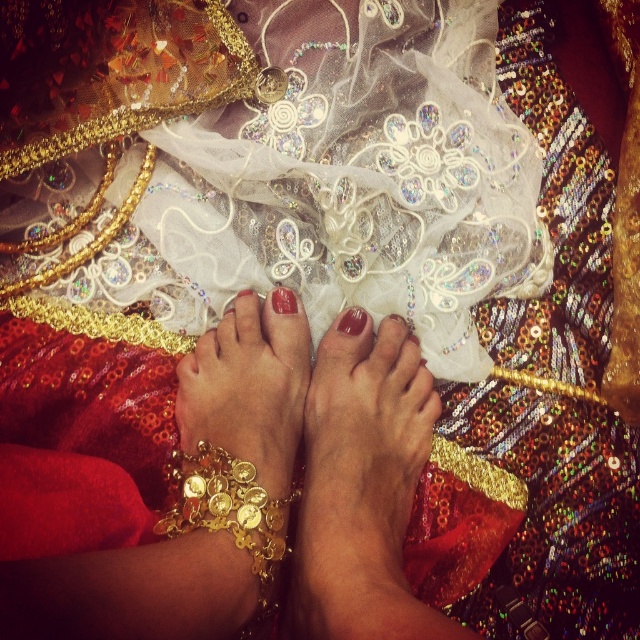
Does gold metallic anklet at center have a larger size compared to matte gold toe at center?

Yes, gold metallic anklet at center is bigger than matte gold toe at center.

Between gold metallic anklet at center and matte gold toe at center, which one is positioned higher?

Positioned higher is matte gold toe at center.

Which is behind, point (240, 506) or point (284, 289)?

Point (284, 289)

Where is `gold metallic anklet at center`? This screenshot has width=640, height=640. gold metallic anklet at center is located at coordinates (234, 467).

What do you see at coordinates (362, 486) in the screenshot?
I see `satin skin at center` at bounding box center [362, 486].

Identify the location of satin skin at center. The image size is (640, 640). (362, 486).

Is gold metallic anklet at center smaller than glossy nail polish at center?

No, gold metallic anklet at center is not smaller than glossy nail polish at center.

How far apart are gold metallic anklet at center and glossy nail polish at center?

The distance of gold metallic anklet at center from glossy nail polish at center is 6.12 inches.

Locate an element on the screen. Image resolution: width=640 pixels, height=640 pixels. gold metallic anklet at center is located at coordinates (234, 467).